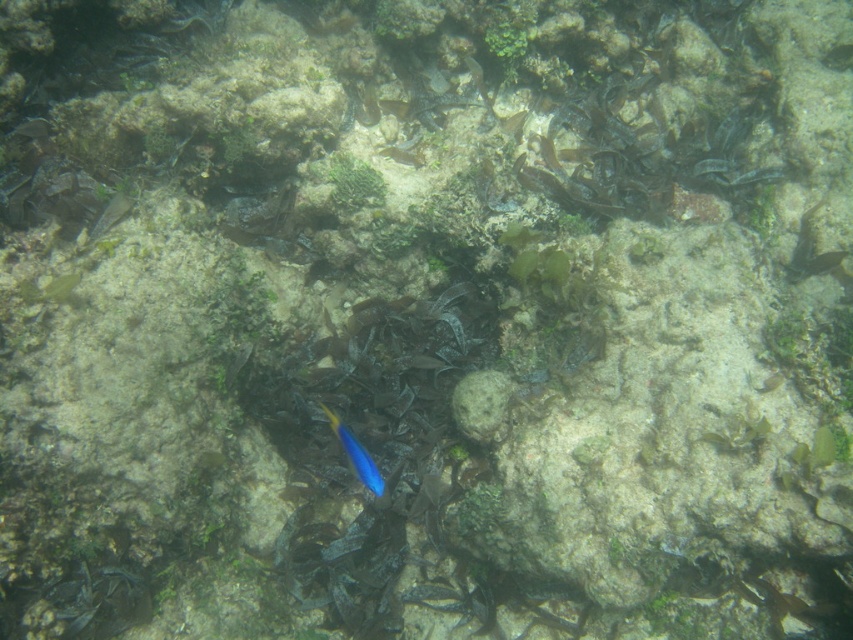
You are a marine biologist observing the underwater scene. You notice the white matte rock at center and the blue glossy fish at center. Which object is wider?

The blue glossy fish at center is wider than the white matte rock at center.